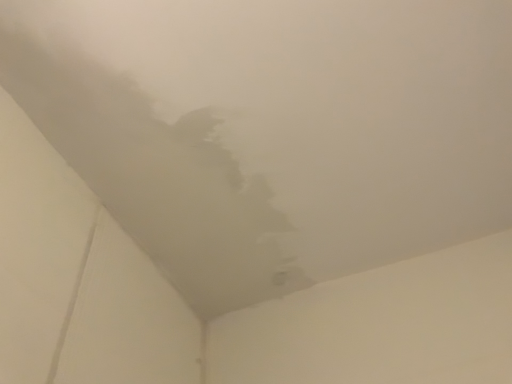
I want to click on white matte ceiling at upper center, so click(x=157, y=179).

What is the approximate width of white matte ceiling at upper center?

32.14 inches.

The height and width of the screenshot is (384, 512). Describe the element at coordinates (157, 179) in the screenshot. I see `white matte ceiling at upper center` at that location.

Image resolution: width=512 pixels, height=384 pixels. I want to click on white matte ceiling at upper center, so click(x=157, y=179).